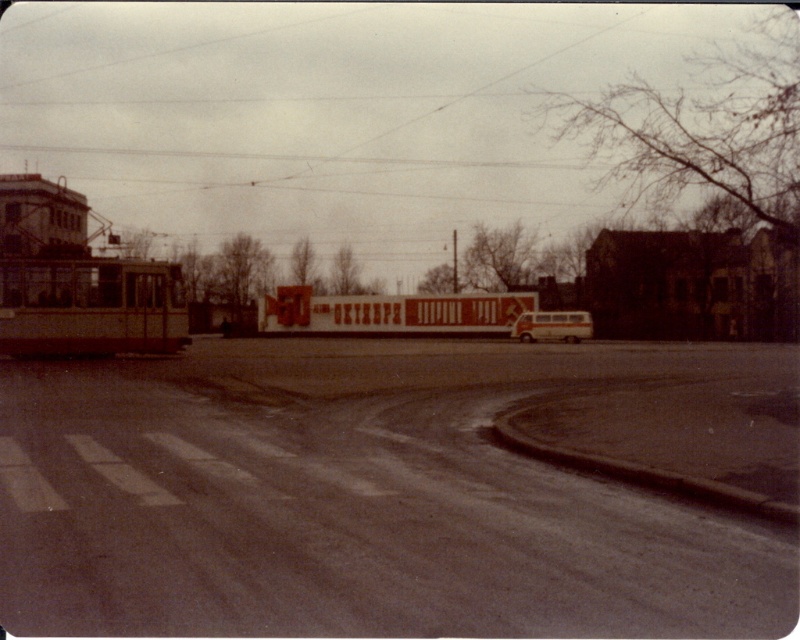
You are a delivery person who needs to cross the road between the metallic silver bus at left and the light beige metallic bus at center. The road is 10 feet wide. Can you safely cross between them without going into the tram area?

The metallic silver bus at left and light beige metallic bus at center are 102.70 feet apart, so yes, you can safely cross between them since the distance between them is much wider than the 10 feet road width required.